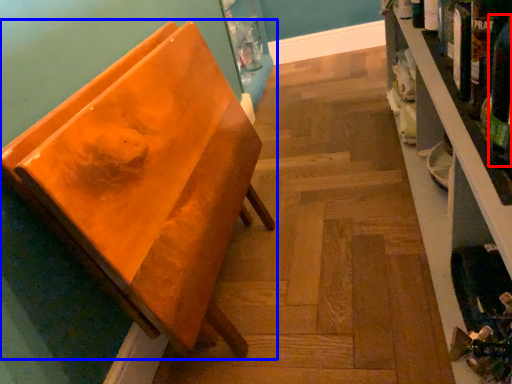
Question: Among these objects, which one is nearest to the camera, beer bottle (highlighted by a red box) or furniture (highlighted by a blue box)?

Choices:
 (A) beer bottle
 (B) furniture

Answer: (A)